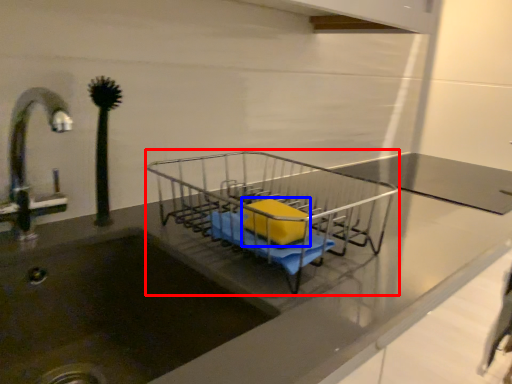
Question: Among these objects, which one is nearest to the camera, trolley (highlighted by a red box) or material (highlighted by a blue box)?

Choices:
 (A) trolley
 (B) material

Answer: (A)